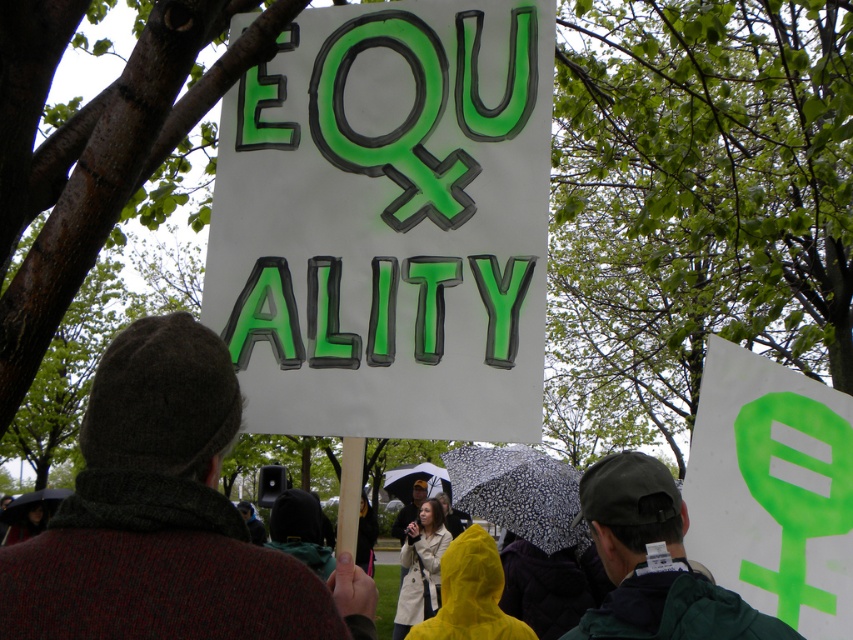
Question: Which is nearer to the black spotted umbrella at center?

Choices:
 (A) green painted cardboard sign at center
 (B) transparent plastic umbrella at center

Answer: (A)

Question: Estimate the real-world distances between objects in this image. Which object is farther from the knitted wool hat at center?

Choices:
 (A) transparent plastic umbrella at center
 (B) green painted cardboard sign at center
 (C) black spotted umbrella at center
 (D) transparent plastic umbrella at lower left

Answer: (A)

Question: Is green painted cardboard sign at center thinner than transparent plastic umbrella at lower left?

Choices:
 (A) no
 (B) yes

Answer: (B)

Question: Is green painted cardboard sign at center to the right of transparent plastic umbrella at lower left from the viewer's perspective?

Choices:
 (A) no
 (B) yes

Answer: (B)

Question: Which object appears farthest from the camera in this image?

Choices:
 (A) black spotted umbrella at center
 (B) transparent plastic umbrella at center

Answer: (B)

Question: Can you confirm if knitted wool hat at center is positioned below transparent plastic umbrella at center?

Choices:
 (A) yes
 (B) no

Answer: (B)